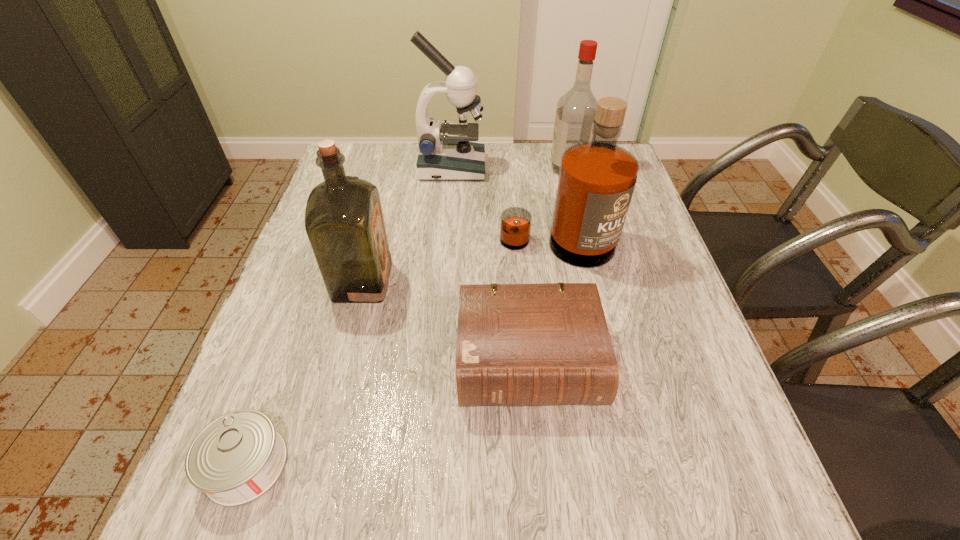
Find the location of a particular element. This screenshot has height=540, width=960. vacant area in the image that satisfies the following two spatial constraints: 1. at the eyepiece of the microscope; 2. on the front side of the can is located at coordinates (428, 464).